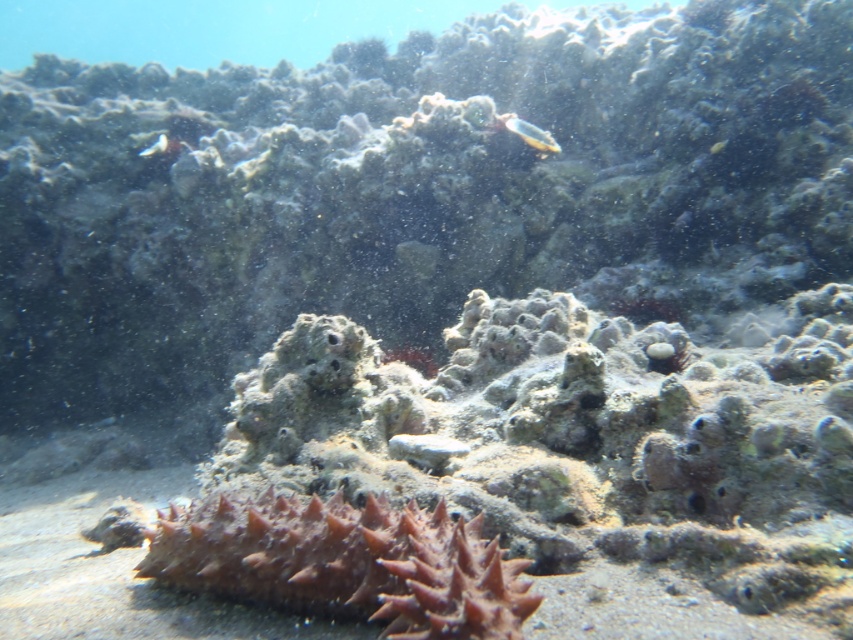
You are a marine biologist observing an underwater scene. You notice two fish in the image. The first is a translucent plastic fish at upper center, and the second is a translucent white fish at upper left. Which of these two fish is positioned more to the right side of the image?

The translucent plastic fish at upper center is positioned more to the right side of the image than the translucent white fish at upper left.

You are a marine biologist observing an underwater scene. You notice the brown spiky sea cucumber at center and the translucent white fish at upper left. Which object is closer to you, the observer?

The brown spiky sea cucumber at center is closer to you because it is in front of the translucent white fish at upper left.

You are a marine biologist diving at a coral reef and notice the brown spiky sea cucumber at center. If your diving mask is 28 inches away from the sea cucumber, can you see it clearly through your mask?

The brown spiky sea cucumber at center and viewer are 27.88 inches apart, so yes, you can see it clearly since the distance is within the 28 inches range.